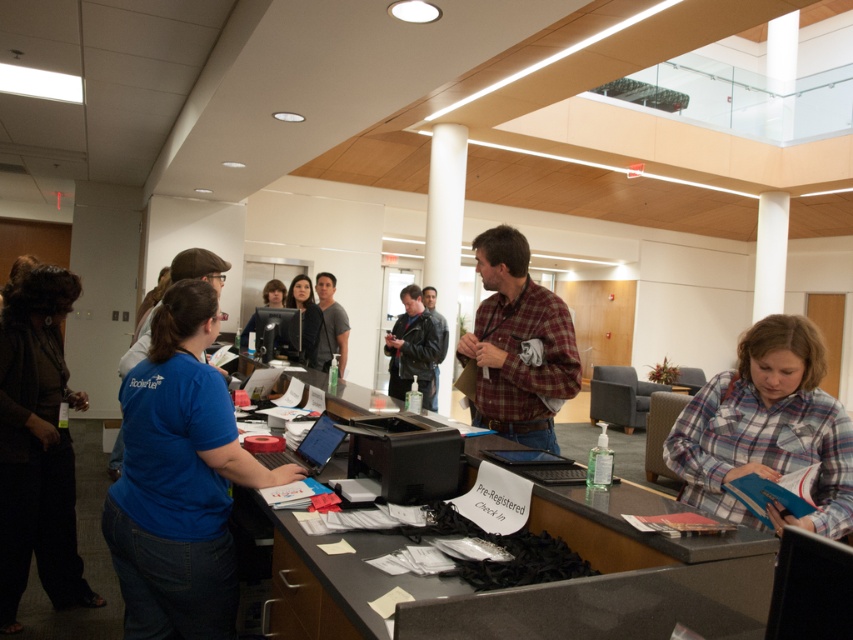
Question: Which object appears farthest from the camera in this image?

Choices:
 (A) smooth gray desk at center
 (B) matte black shirt at center

Answer: (B)

Question: Can you confirm if blue cotton shirt at center is wider than plaid fabric shirt at center?

Choices:
 (A) no
 (B) yes

Answer: (B)

Question: Based on their relative distances, which object is farther from the matte black laptop at center?

Choices:
 (A) blue cotton shirt at center
 (B) matte gray shirt at center
 (C) plaid fabric shirt at center
 (D) smooth gray desk at center

Answer: (B)

Question: Does plaid fabric shirt at center lie behind matte black shirt at center?

Choices:
 (A) yes
 (B) no

Answer: (B)

Question: Based on their relative distances, which object is farther from the plaid flannel shirt at lower right?

Choices:
 (A) smooth gray desk at center
 (B) matte gray shirt at center
 (C) plaid fabric shirt at center

Answer: (B)

Question: Can you confirm if plaid fabric shirt at center is smaller than matte black monitor at center?

Choices:
 (A) yes
 (B) no

Answer: (B)